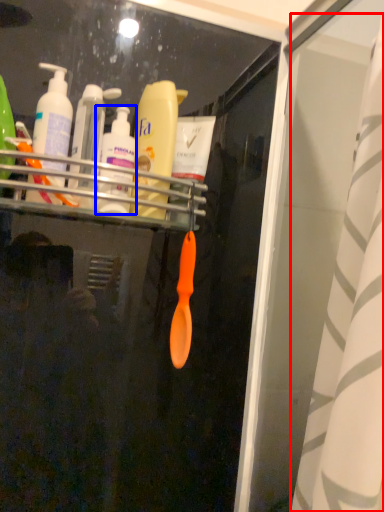
Question: Which of the following is the closest to the observer, shower curtain (highlighted by a red box) or toiletry (highlighted by a blue box)?

Choices:
 (A) shower curtain
 (B) toiletry

Answer: (A)